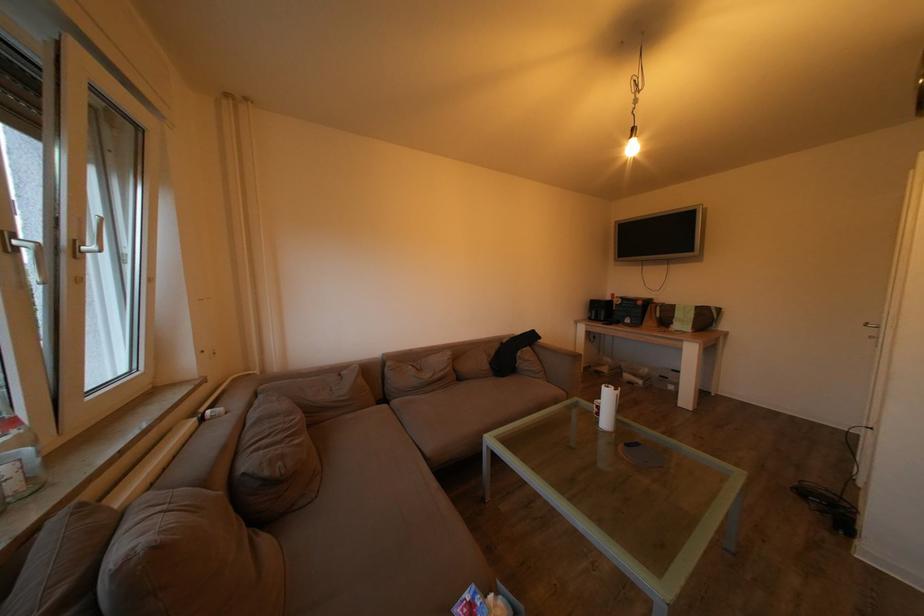
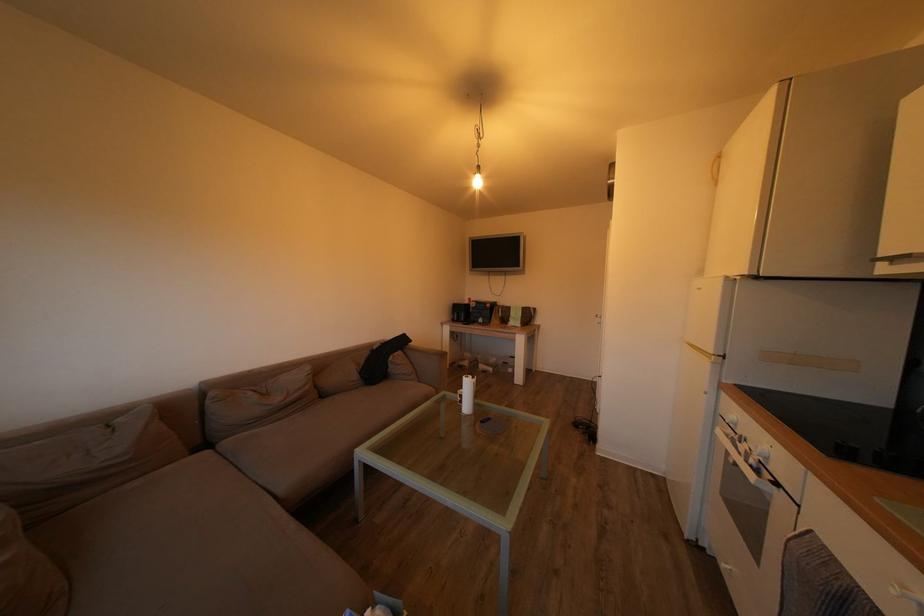
Question: In a continuous first-person perspective shot, in which direction is the camera moving?

Choices:
 (A) Left
 (B) Right
 (C) Forward
 (D) Backward

Answer: (D)